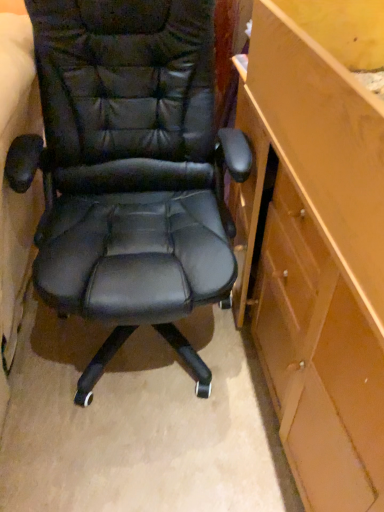
What do you see at coordinates (321, 247) in the screenshot? I see `light brown wood dresser at right` at bounding box center [321, 247].

Where is `light brown wood dresser at right`? Image resolution: width=384 pixels, height=512 pixels. light brown wood dresser at right is located at coordinates (321, 247).

I want to click on light brown wood dresser at right, so click(321, 247).